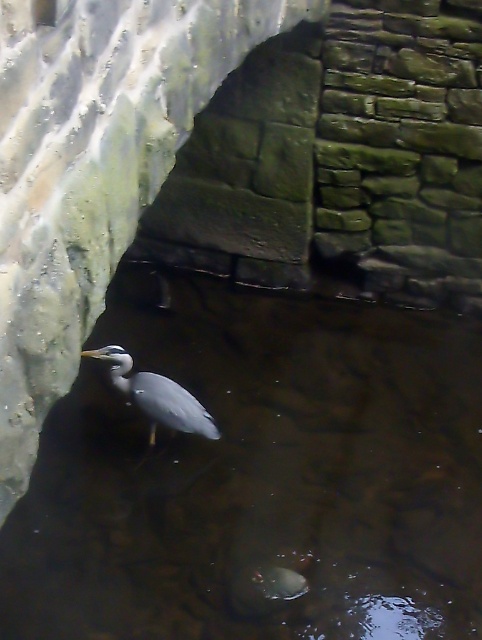
Question: Does clear water at center appear on the right side of gray matte bird at center?

Choices:
 (A) yes
 (B) no

Answer: (A)

Question: Which point is farther to the camera?

Choices:
 (A) clear water at center
 (B) gray matte bird at center

Answer: (B)

Question: Where is clear water at center located in relation to gray matte bird at center in the image?

Choices:
 (A) left
 (B) right

Answer: (B)

Question: Is clear water at center closer to the viewer compared to gray matte bird at center?

Choices:
 (A) no
 (B) yes

Answer: (B)

Question: Among these objects, which one is farthest from the camera?

Choices:
 (A) gray matte bird at center
 (B) clear water at center

Answer: (A)

Question: Which of the following is the farthest from the observer?

Choices:
 (A) gray matte bird at center
 (B) clear water at center

Answer: (A)